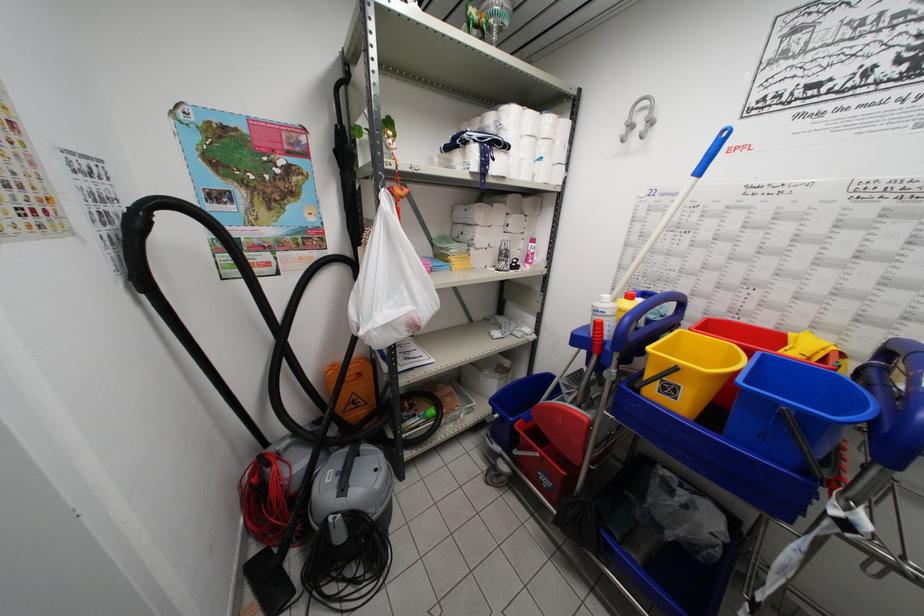
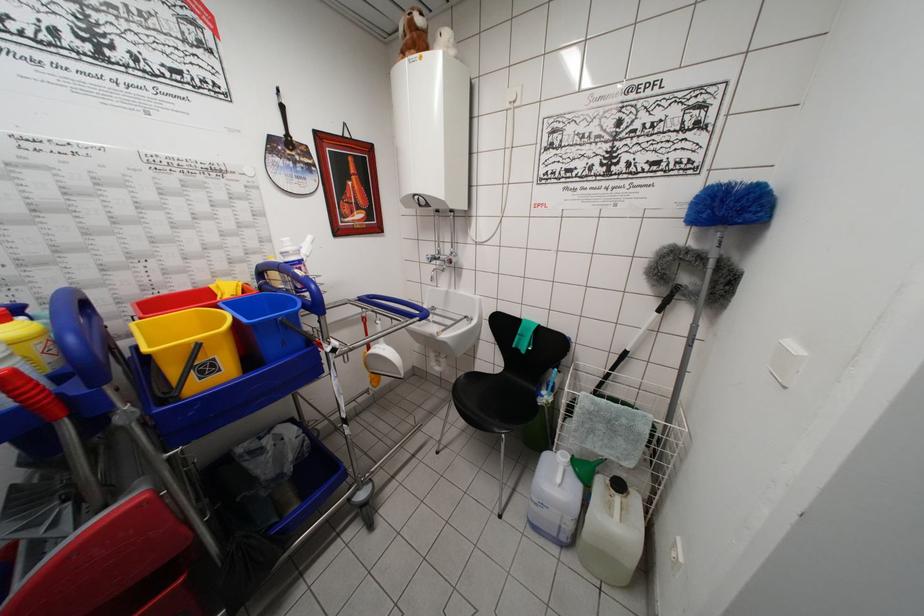
Locate, in the second image, the point that corresponds to (x=796, y=418) in the first image.

(287, 323)